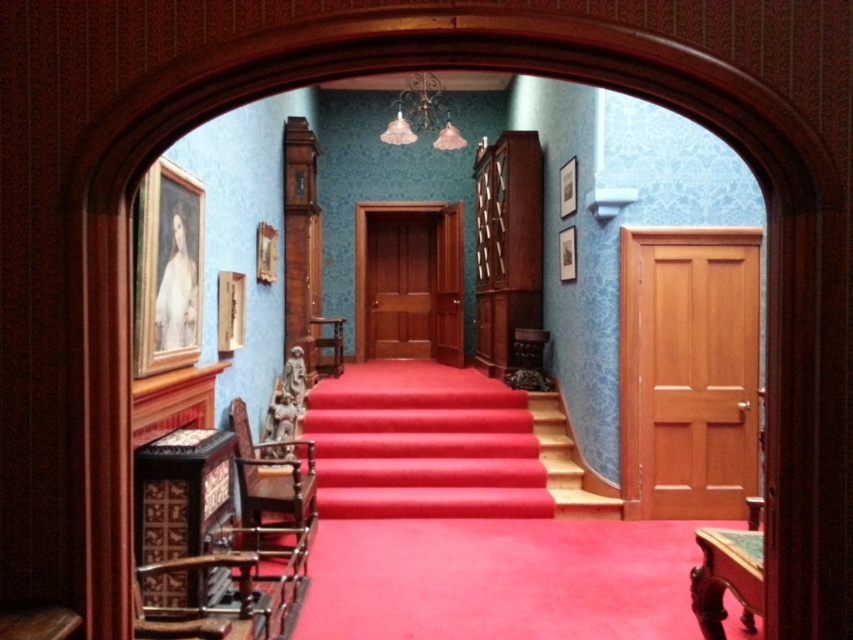
You are moving a large antique table into the hallway. The table is 2 meters long. You need to place it in the hallway without overlapping any existing objects. Which object from the velvet red carpet at center and wooden at center should you avoid placing the table over?

The velvet red carpet at center has a larger size compared to wooden at center, so you should avoid placing the table over the wooden at center since it is smaller and might be in the way.

You are an interior designer assessing the hallway. You need to place a 1.2 meter wide decorative rug. Given the velvet red carpet at center and the wooden at center, which one can accommodate the rug without exceeding its width?

The velvet red carpet at center can accommodate the rug since its width is larger than the wooden at center, making it suitable for the 1.2 meter wide decorative rug.